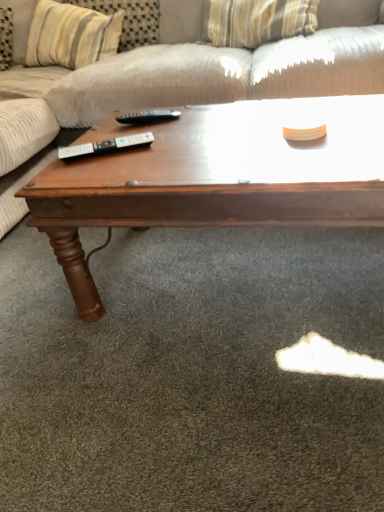
Question: Can you see striped fabric pillow at upper center touching textured beige fabric couch at upper center?

Choices:
 (A) yes
 (B) no

Answer: (B)

Question: Is striped fabric pillow at upper center not inside textured beige fabric couch at upper center?

Choices:
 (A) no
 (B) yes

Answer: (A)

Question: Considering the relative positions of striped fabric pillow at upper center and textured beige fabric couch at upper center in the image provided, is striped fabric pillow at upper center to the left of textured beige fabric couch at upper center from the viewer's perspective?

Choices:
 (A) no
 (B) yes

Answer: (B)

Question: Is striped fabric pillow at upper center facing away from textured beige fabric couch at upper center?

Choices:
 (A) no
 (B) yes

Answer: (B)

Question: Is textured beige fabric couch at upper center inside striped fabric pillow at upper center?

Choices:
 (A) no
 (B) yes

Answer: (A)

Question: Do you think black plastic remote at center, which ranks as the second remote in back-to-front order, is within black plastic remote at center, the 2th remote when ordered from front to back, or outside of it?

Choices:
 (A) inside
 (B) outside

Answer: (B)

Question: From their relative heights in the image, would you say black plastic remote at center, which is the 1th remote from bottom to top, is taller or shorter than black plastic remote at center, the first remote in the top-to-bottom sequence?

Choices:
 (A) short
 (B) tall

Answer: (A)

Question: Is black plastic remote at center, which is the 1th remote from bottom to top, to the left or to the right of black plastic remote at center, the 2th remote when ordered from front to back, in the image?

Choices:
 (A) left
 (B) right

Answer: (A)

Question: From the image's perspective, relative to black plastic remote at center, the first remote in the top-to-bottom sequence, is black plastic remote at center, positioned as the 1th remote in front-to-back order, above or below?

Choices:
 (A) below
 (B) above

Answer: (A)

Question: Based on their sizes in the image, would you say striped fabric pillow at upper center is bigger or smaller than black plastic remote at center, which ranks as the second remote in back-to-front order?

Choices:
 (A) big
 (B) small

Answer: (A)

Question: From a real-world perspective, is striped fabric pillow at upper center above or below black plastic remote at center, the second remote when ordered from top to bottom?

Choices:
 (A) below
 (B) above

Answer: (B)

Question: Considering the positions of point (79, 9) and point (102, 142), is point (79, 9) closer or farther from the camera than point (102, 142)?

Choices:
 (A) closer
 (B) farther

Answer: (B)

Question: Visually, is striped fabric pillow at upper center positioned to the left or to the right of black plastic remote at center, which ranks as the second remote in back-to-front order?

Choices:
 (A) right
 (B) left

Answer: (B)

Question: From a real-world perspective, is textured beige fabric couch at upper center physically located above or below black plastic remote at center, which is the 1th remote from bottom to top?

Choices:
 (A) below
 (B) above

Answer: (A)

Question: Would you say textured beige fabric couch at upper center is to the left or to the right of black plastic remote at center, positioned as the 1th remote in front-to-back order, in the picture?

Choices:
 (A) right
 (B) left

Answer: (B)